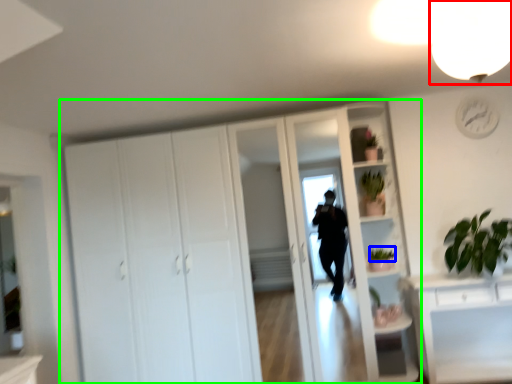
Question: Which object is positioned farthest from light fixture (highlighted by a red box)? Select from plant (highlighted by a blue box) and cupboard (highlighted by a green box).

Choices:
 (A) plant
 (B) cupboard

Answer: (A)